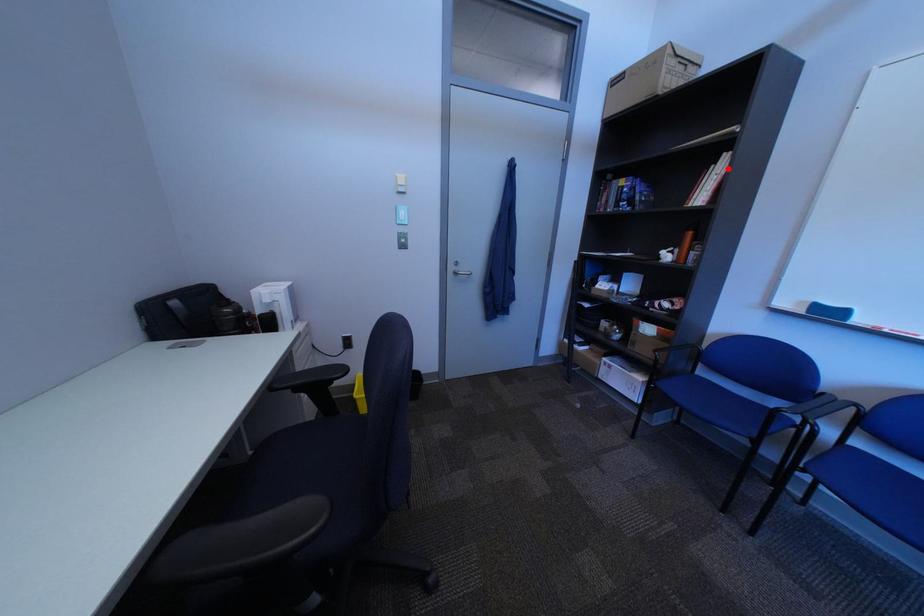
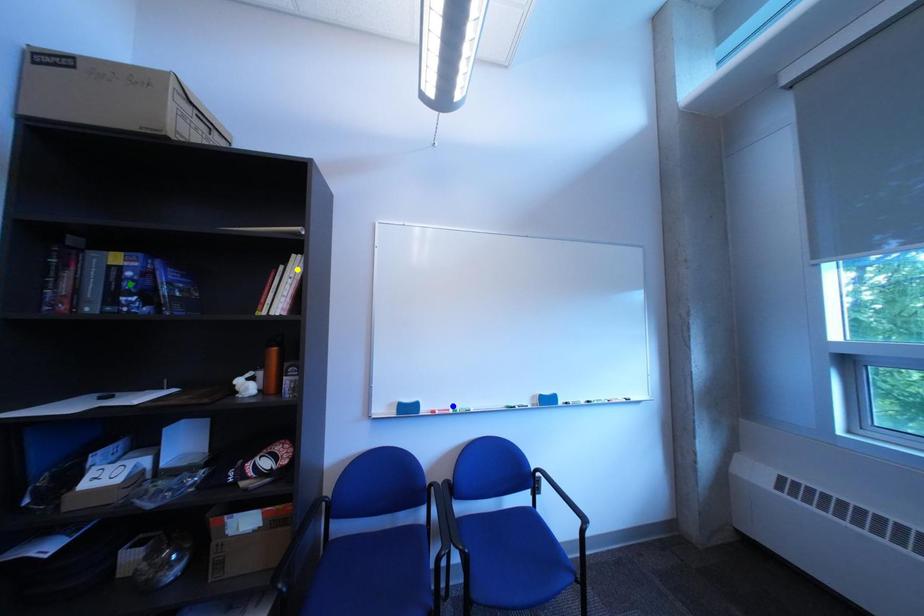
Question: I am providing you with two images of the same scene from different viewpoints. A red point is marked on the first image. You are given multiple points on the second image. Which spot in image 2 lines up with the point in image 1?

Choices:
 (A) yellow point
 (B) green point
 (C) blue point

Answer: (A)